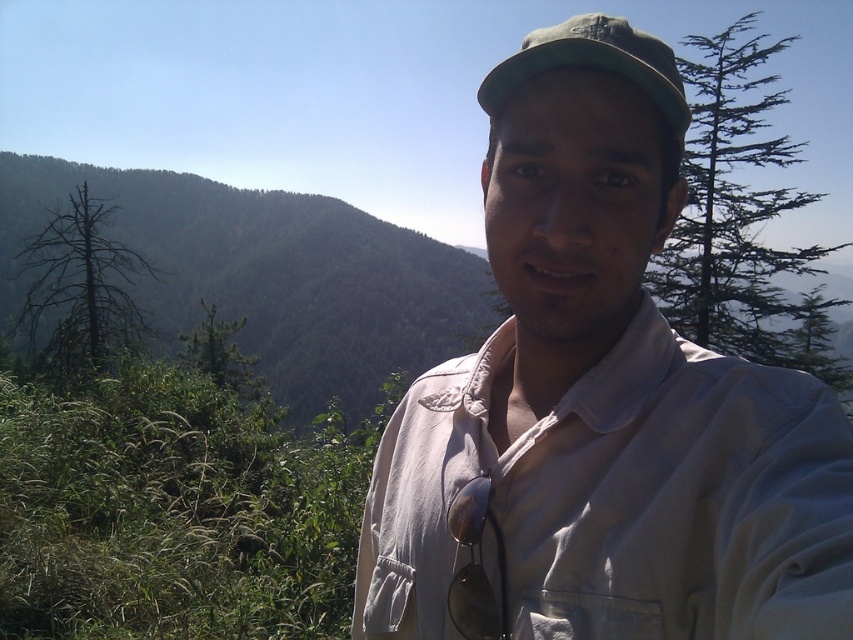
Between green coniferous tree at upper right and green fabric cap at upper center, which one has more height?

green coniferous tree at upper right

Which is below, green coniferous tree at upper right or green fabric cap at upper center?

Positioned lower is green fabric cap at upper center.

Is point (836, 364) positioned in front of point (523, 40)?

Yes.

Find the location of a particular element. The height and width of the screenshot is (640, 853). green coniferous tree at upper right is located at coordinates (741, 220).

Does white cotton shirt at center have a smaller size compared to green fabric cap at upper center?

Indeed, white cotton shirt at center has a smaller size compared to green fabric cap at upper center.

Can you confirm if white cotton shirt at center is positioned to the right of green fabric cap at upper center?

Incorrect, white cotton shirt at center is not on the right side of green fabric cap at upper center.

Which is behind, point (817, 528) or point (590, 24)?

Positioned behind is point (590, 24).

In order to click on white cotton shirt at center in this screenshot , I will do `click(605, 397)`.

Is white cotton shirt at center to the left of green coniferous tree at upper right from the viewer's perspective?

Indeed, white cotton shirt at center is positioned on the left side of green coniferous tree at upper right.

Is white cotton shirt at center wider than green coniferous tree at upper right?

No.

Is point (640, 246) positioned behind point (766, 93)?

No, it is not.

In order to click on white cotton shirt at center in this screenshot , I will do `click(605, 397)`.